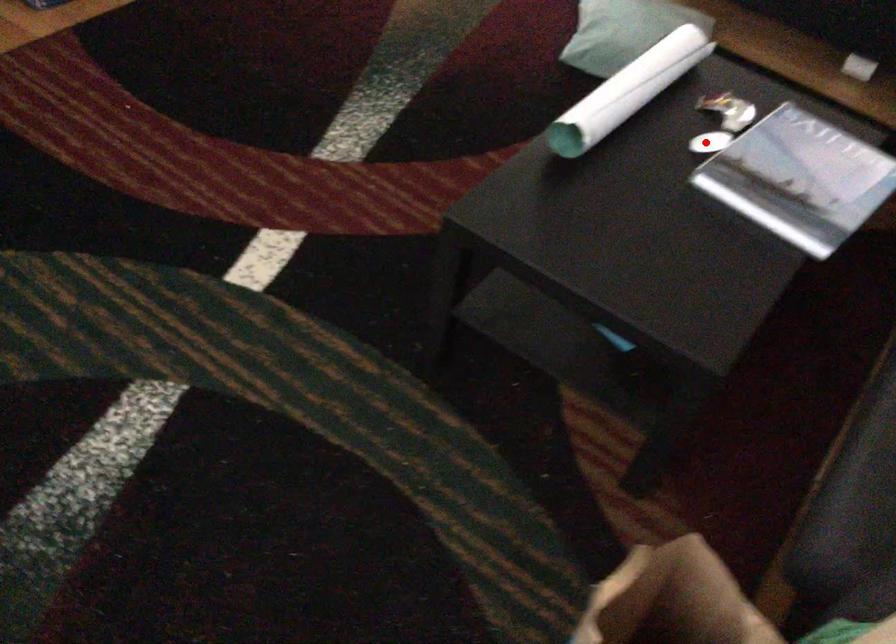
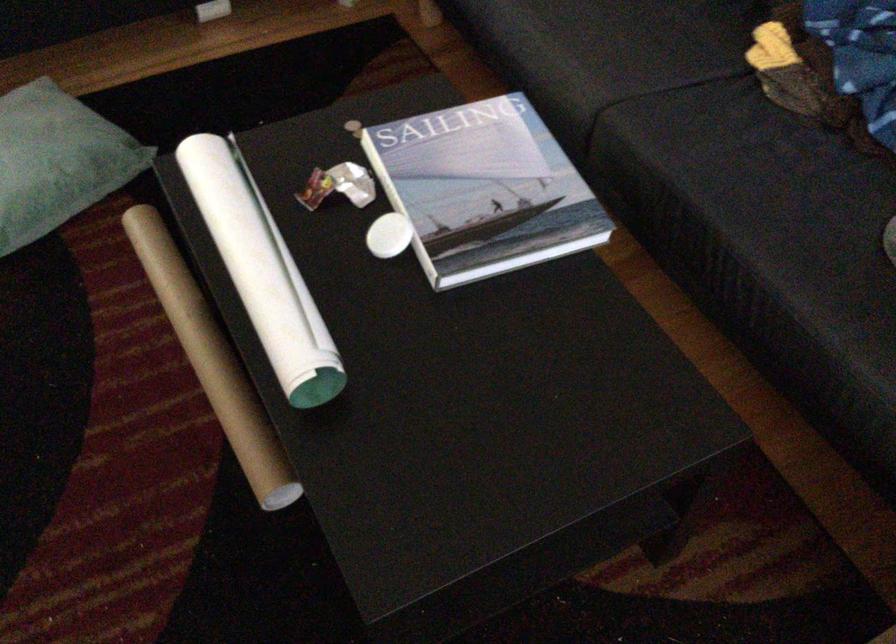
Question: I am providing you with two images of the same scene from different viewpoints. Image1 has a red point marked. In image2, the corresponding 3D location appears at what relative position? Reply with the corresponding letter.

Choices:
 (A) Closer
 (B) Farther

Answer: (A)